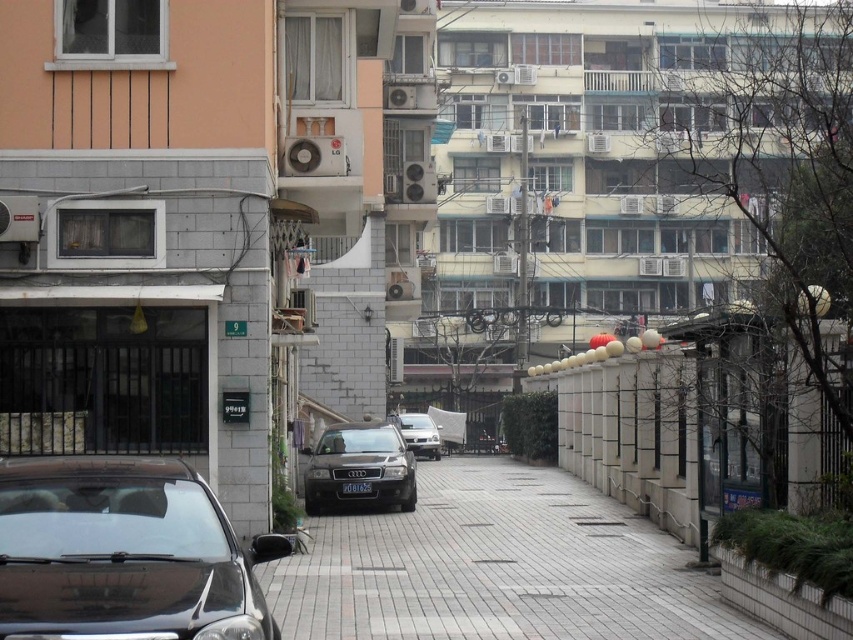
You are a delivery person trying to park your vehicle between the black glossy car at lower left and the satin gold car at center. Your vehicle is 1.6 meters tall. Can you fit your vehicle in the space between them?

The black glossy car at lower left has a lesser height compared to the satin gold car at center, but the height difference does not affect the vertical clearance between them. The space between the two cars is determined by their positions along the street, not their heights. Since the question does not provide information about the distance between them, it is impossible to determine if your vehicle can fit based on height alone.

You are a delivery person trying to park your 1.8 meters tall delivery cart between the satin gold car at center and the sleek silver sedan at center. Can your cart fit vertically between them?

The satin gold car at center is taller than the sleek silver sedan at center. The height between them is not specified, but since the delivery cart is 1.8 meters tall, it might not fit if the space between the cars is less than 1.8 meters. However, without exact measurements, it is uncertain.